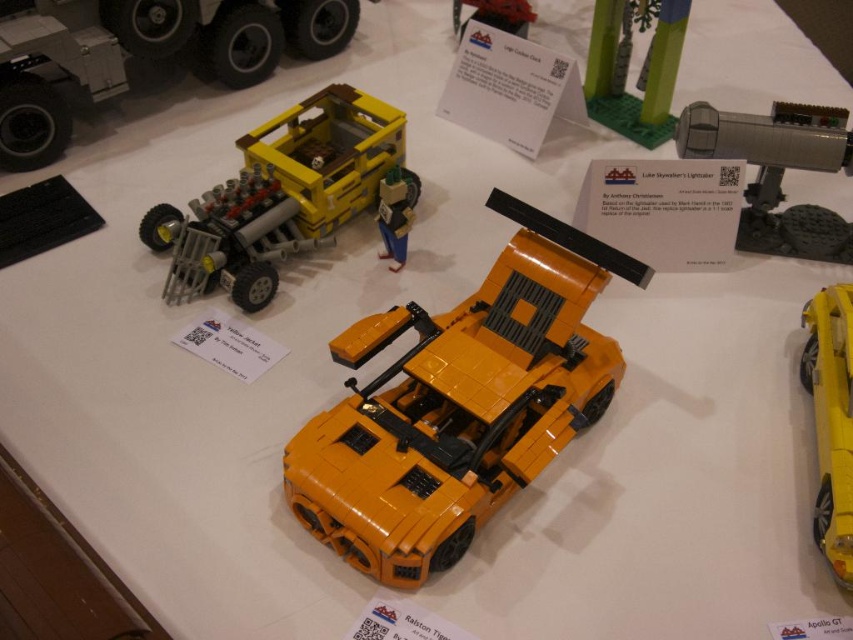
Can you confirm if yellow matte truck at upper left is positioned below shiny yellow car at center?

Incorrect, yellow matte truck at upper left is not positioned below shiny yellow car at center.

Is point (300, 163) positioned before point (802, 314)?

That is False.

Where is `yellow matte truck at upper left`? This screenshot has width=853, height=640. yellow matte truck at upper left is located at coordinates (281, 196).

Is the position of green matte tree at upper center less distant than that of matte black car at upper center?

Yes.

Between green matte tree at upper center and matte black car at upper center, which one appears on the left side from the viewer's perspective?

matte black car at upper center is more to the left.

I want to click on green matte tree at upper center, so [646, 76].

Find the location of `green matte tree at upper center`. green matte tree at upper center is located at coordinates (646, 76).

Can you confirm if matte yellow truck at upper center is positioned to the right of matte black car at upper center?

No, matte yellow truck at upper center is not to the right of matte black car at upper center.

Where is `matte yellow truck at upper center`? matte yellow truck at upper center is located at coordinates point(140,52).

I want to click on matte yellow truck at upper center, so click(x=140, y=52).

Find the location of `matte yellow truck at upper center`. matte yellow truck at upper center is located at coordinates (140, 52).